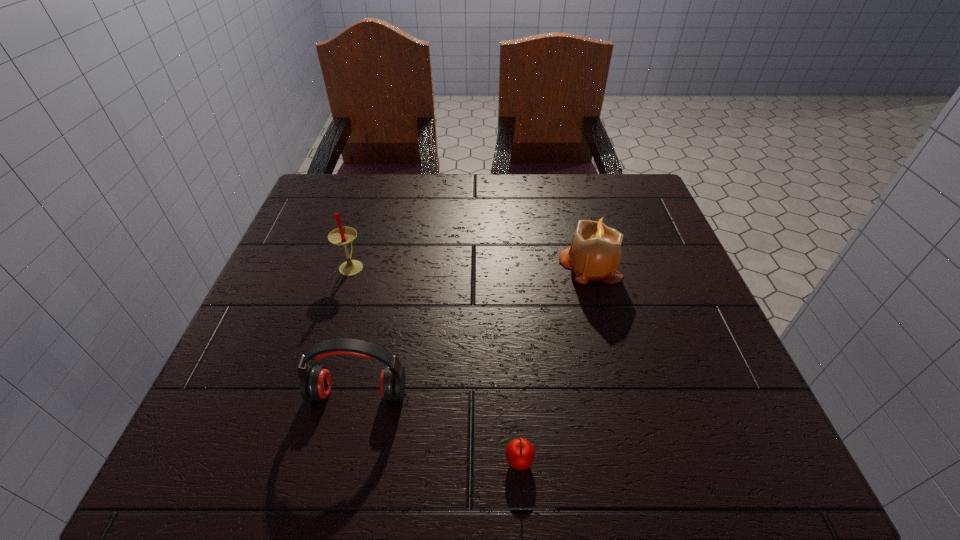
Find the location of `the left candle`. the left candle is located at coordinates [x=342, y=236].

Locate an element on the screen. This screenshot has height=540, width=960. the right candle is located at coordinates (594, 255).

I want to click on the third farthest object, so click(x=315, y=384).

Identify the location of the nearest object. The width and height of the screenshot is (960, 540). (520, 454).

Where is `the shortest object`? the shortest object is located at coordinates (520, 454).

Image resolution: width=960 pixels, height=540 pixels. I want to click on free space located 0.350m on the right of the left candle, so click(x=521, y=266).

Locate an element on the screen. The width and height of the screenshot is (960, 540). vacant space located 0.350m on the left of the right candle is located at coordinates (403, 266).

Identify the location of free location located 0.180m on the right of the shortest object. (652, 461).

At what (x,y) coordinates should I click in order to perform the action: click on object located at the near edge. Please return your answer as a coordinate pair (x, y). Image resolution: width=960 pixels, height=540 pixels. Looking at the image, I should click on (520, 454).

I want to click on object located in the left edge section of the desktop, so click(x=342, y=236).